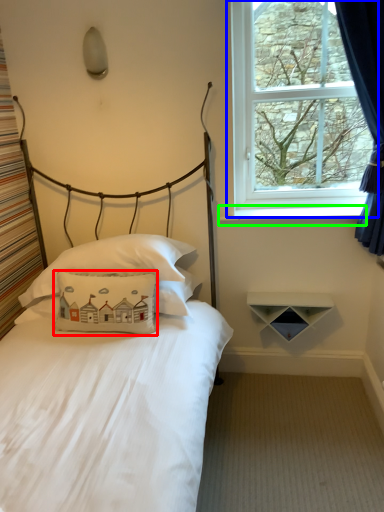
Question: Which is farther away from pillow (highlighted by a red box)? window (highlighted by a blue box) or window sill (highlighted by a green box)?

Choices:
 (A) window
 (B) window sill

Answer: (A)